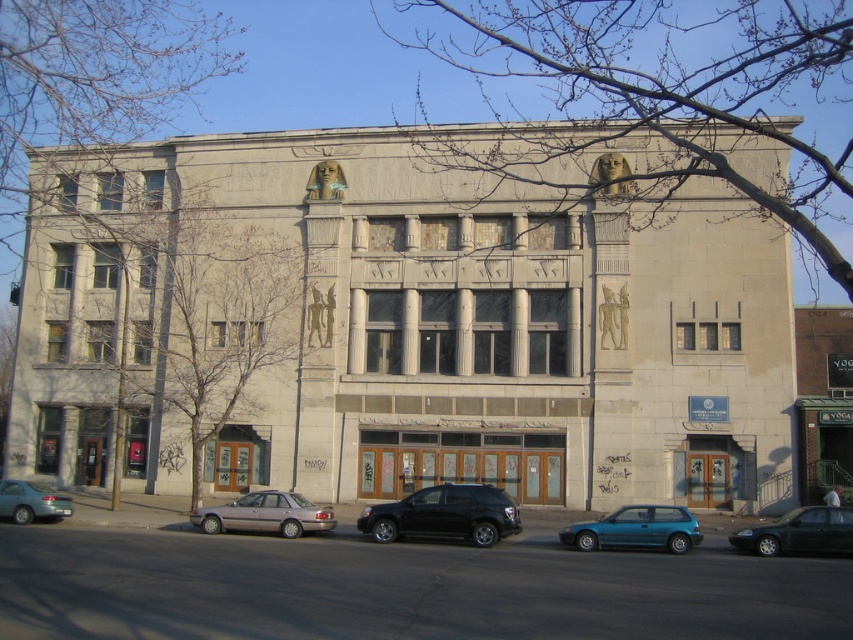
Based on the photo, what are the coordinates of the green matte sedan at lower right in the image?

The coordinates of the green matte sedan at lower right are at point (799, 532).

You are standing in front of the building and want to take a photo of the black matte suv at center without including the pharaoh statues in the background. Can you step back enough to do so?

The black matte suv at center is 85.23 feet from camera. Since the pharaoh statues are part of the building facade, stepping back would include them in the background unless you use a telephoto lens to zoom in. However, at that distance, the background may still blur depending on camera settings. Alternatively, moving to the side could angle the view away from the statues, but the question specifies stepping back. Therefore, stepping back alone may not exclude the statues unless the camera angle allows it.

You are driving a car and want to park in the parking lot near the building. You see a green matte sedan at lower right and a teal matte sedan at lower left in the image. Which car is parked higher up relative to the other?

The green matte sedan at lower right is parked higher up than the teal matte sedan at lower left because it is positioned above it.